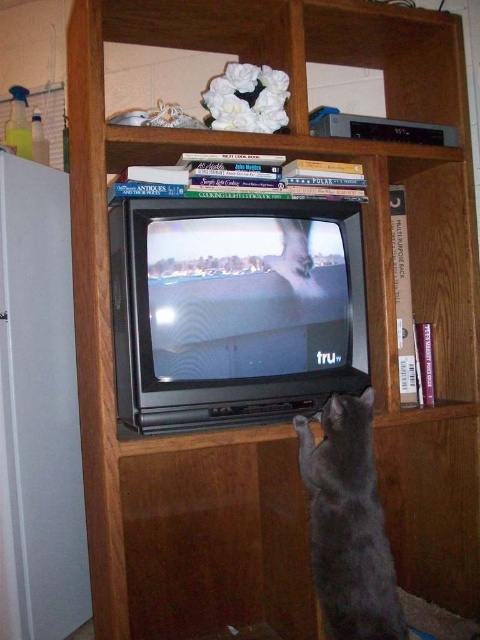
Question: Does matte white refrigerator at left come in front of gray fur cat at lower center?

Choices:
 (A) yes
 (B) no

Answer: (B)

Question: Is matte white refrigerator at left below gray fur cat at lower center?

Choices:
 (A) yes
 (B) no

Answer: (B)

Question: Considering the relative positions of matte white refrigerator at left and gray fur cat at lower center in the image provided, where is matte white refrigerator at left located with respect to gray fur cat at lower center?

Choices:
 (A) right
 (B) left

Answer: (B)

Question: Among these points, which one is nearest to the camera?

Choices:
 (A) (63, 556)
 (B) (374, 508)

Answer: (B)

Question: Which of the following is the closest to the observer?

Choices:
 (A) (348, 595)
 (B) (23, 380)

Answer: (A)

Question: Which of the following is the farthest from the observer?

Choices:
 (A) (348, 596)
 (B) (17, 339)

Answer: (B)